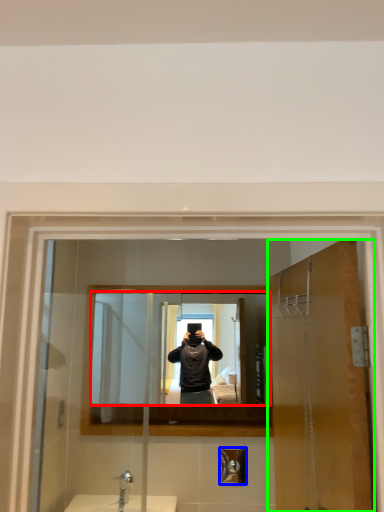
Question: Considering the real-world distances, which object is closest to mirror (highlighted by a red box)? shower (highlighted by a blue box) or door (highlighted by a green box).

Choices:
 (A) shower
 (B) door

Answer: (A)